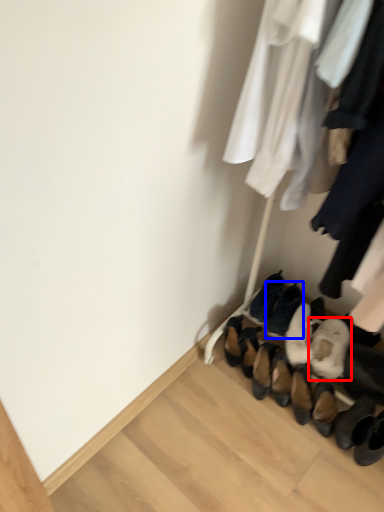
Question: Which object appears farthest to the camera in this image, footwear (highlighted by a red box) or footwear (highlighted by a blue box)?

Choices:
 (A) footwear
 (B) footwear

Answer: (B)